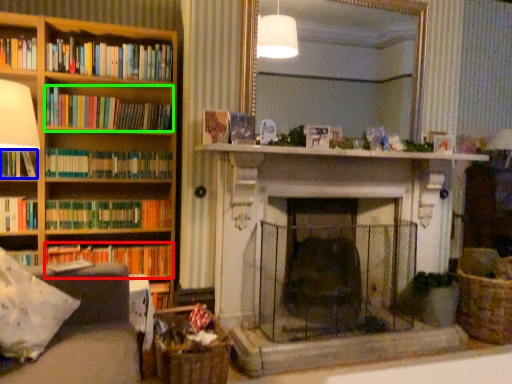
Question: Which object is the closest to the book (highlighted by a red box)? Choose among these: book (highlighted by a blue box) or book (highlighted by a green box).

Choices:
 (A) book
 (B) book

Answer: (A)